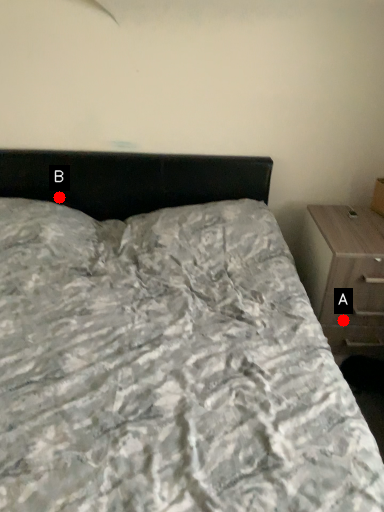
Question: Two points are circled on the image, labeled by A and B beside each circle. Among these points, which one is farthest from the camera?

Choices:
 (A) A is further
 (B) B is further

Answer: (B)